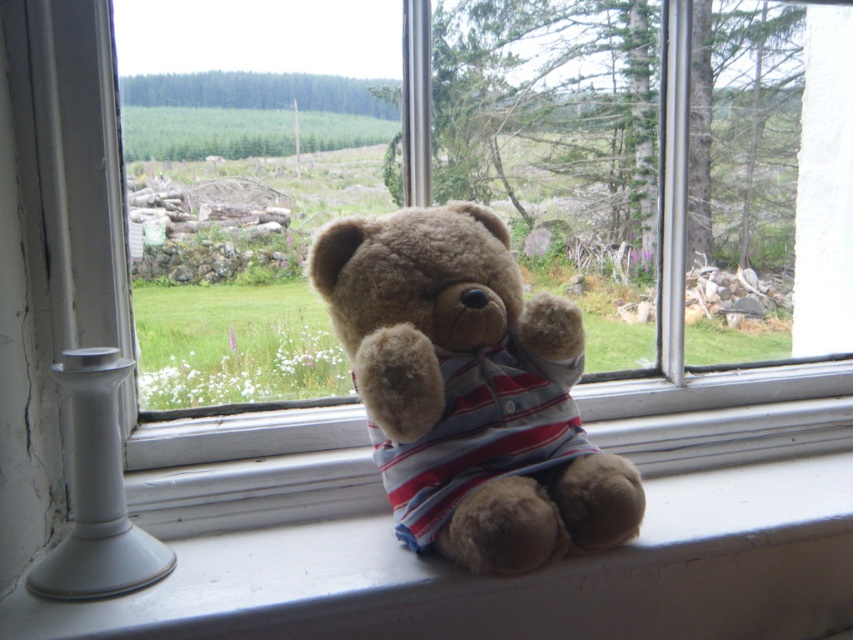
You are arranging a small decorative item on the windowsill. If you place it to the left of the fuzzy brown bear at center, will it also be to the left of the white smooth window sill at lower center?

Yes, because the white smooth window sill at lower center is to the right of the fuzzy brown bear at center, placing the item to the left of the fuzzy brown bear at center would also place it to the left of the white smooth window sill at lower center.

You are a delivery robot trying to place a package on the white smooth window sill at lower center. The package has a delivery point at coordinates 0.903, 0.600. Can you confirm if the package will land on the correct location?

The white smooth window sill at lower center is located at point (511, 577), so yes, the package will land on the correct location.

You are an interior designer planning to place a new decorative item on the windowsill where the teddy bear is currently positioned. The teddy bear is located at point (511, 577). Can you confirm if this point is on the white smooth window sill at lower center?

Yes, the point (511, 577) marks the white smooth window sill at lower center, so placing the new decorative item there would be appropriate.